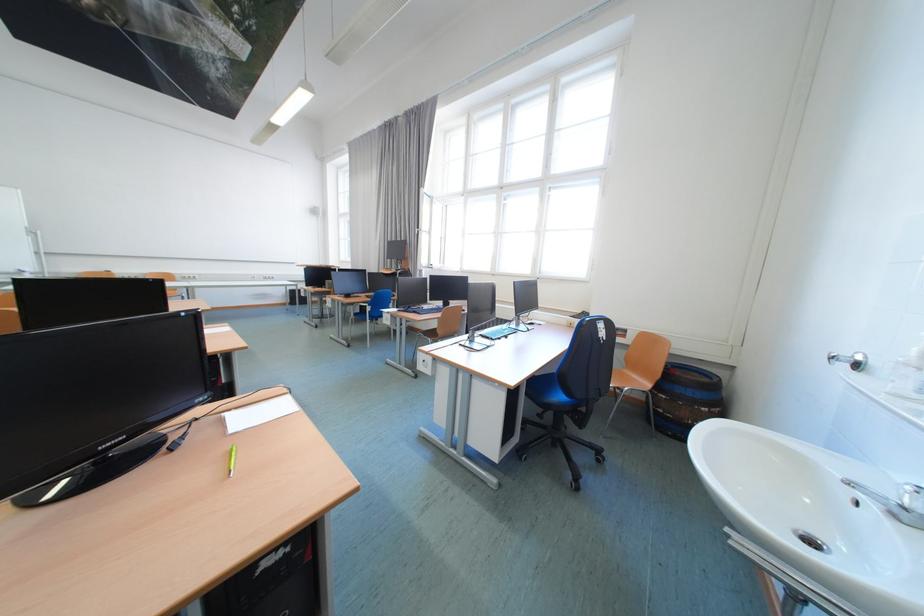
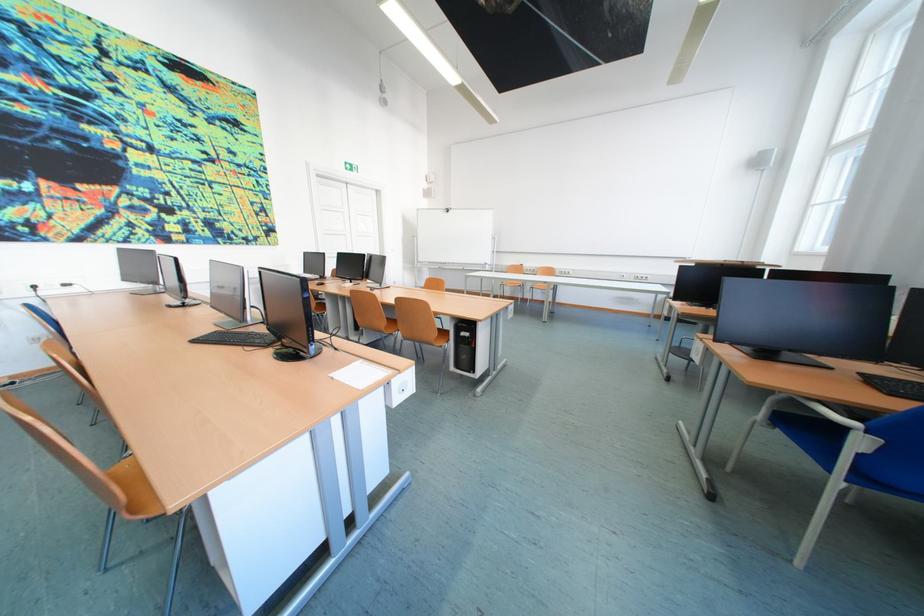
In the second image, find the point that corresponds to pixel 381 299 in the first image.

(886, 382)